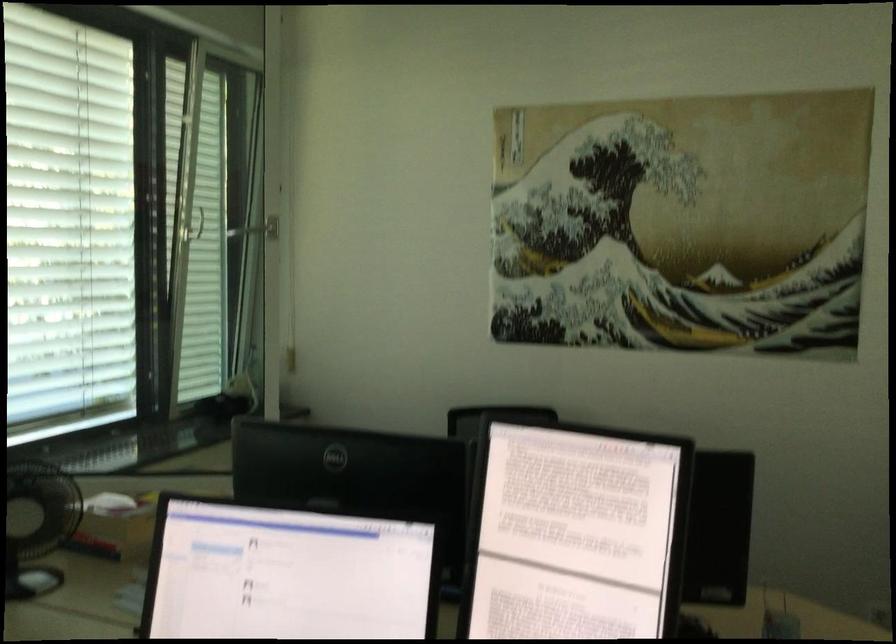
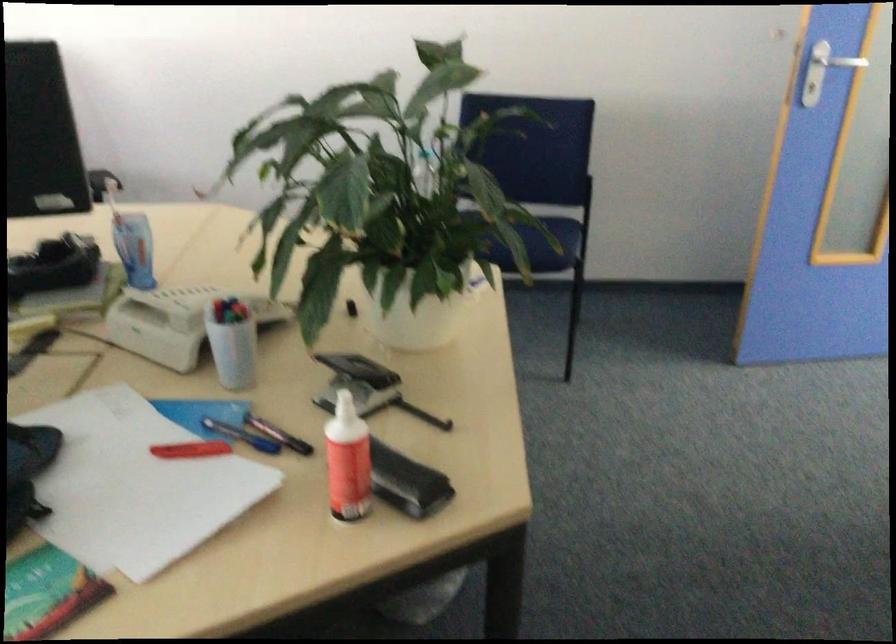
First-person continuous shooting, in which direction is the camera rotating?

The camera rotated toward right-down.